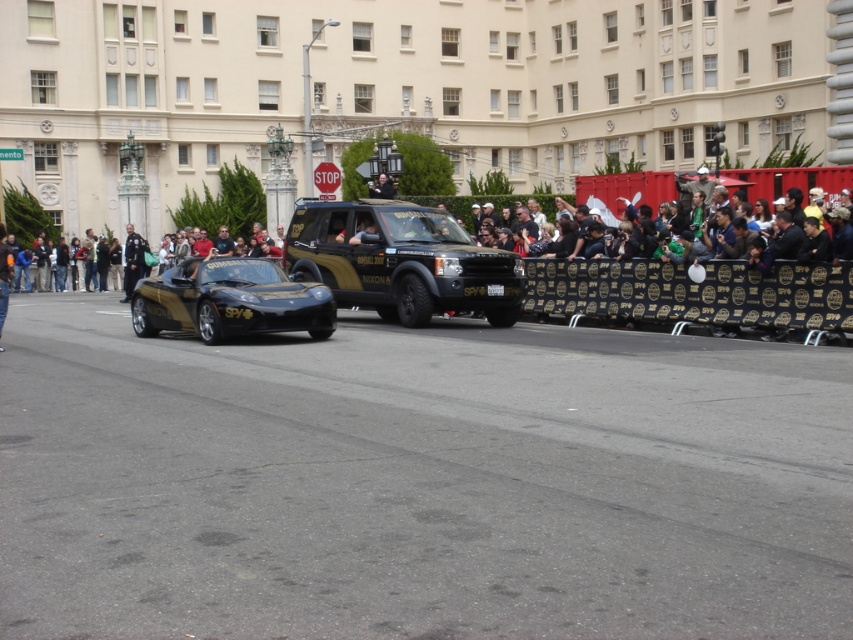
Question: Which point is closer to the camera taking this photo?

Choices:
 (A) (596, 189)
 (B) (381, 179)
 (C) (437, 275)

Answer: (C)

Question: Can you confirm if gold matte jeep at center is smaller than gold metallic helmet at center?

Choices:
 (A) no
 (B) yes

Answer: (A)

Question: Which point is farther from the camera taking this photo?

Choices:
 (A) (183, 300)
 (B) (4, 234)
 (C) (762, 182)
 (D) (378, 177)

Answer: (C)

Question: Which of the following is the farthest from the observer?

Choices:
 (A) gold metallic helmet at center
 (B) black leather jacket at center
 (C) dark gray fabric crowd at center
 (D) gold matte jeep at center

Answer: (C)

Question: Can you confirm if gold metallic sports car at center is thinner than gold metallic helmet at center?

Choices:
 (A) yes
 (B) no

Answer: (B)

Question: Does gold metallic sports car at center appear on the left side of dark gray fabric crowd at center?

Choices:
 (A) no
 (B) yes

Answer: (B)